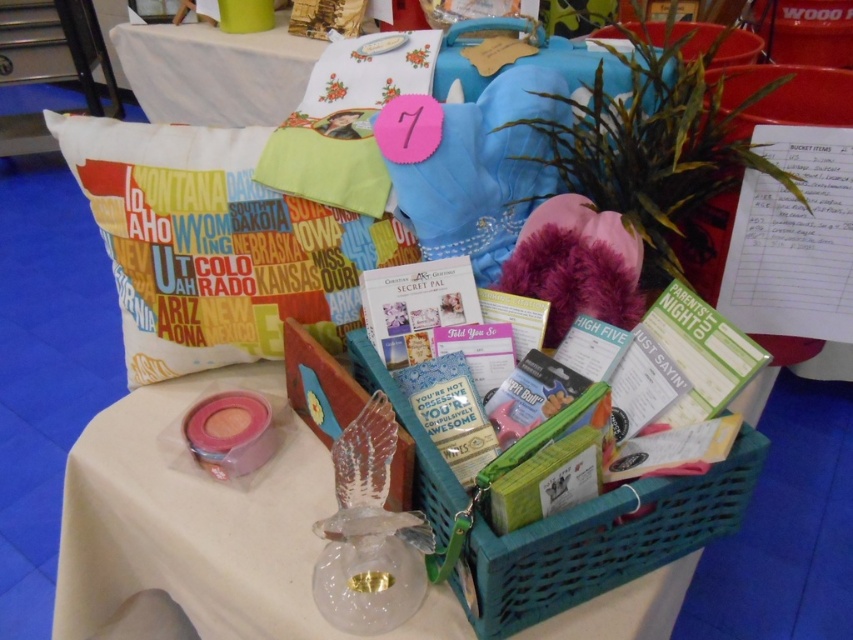
Question: Is the position of white fabric pillow at upper left less distant than that of white fabric tablecloth at upper center?

Choices:
 (A) no
 (B) yes

Answer: (B)

Question: Does white fabric pillow at upper left have a larger size compared to white fabric tablecloth at upper center?

Choices:
 (A) no
 (B) yes

Answer: (A)

Question: Which point is farther from the camera taking this photo?

Choices:
 (A) (196, 305)
 (B) (556, 538)
 (C) (283, 118)
 (D) (270, 380)

Answer: (C)

Question: Does white fabric pillow at upper left appear on the left side of teal plastic basket at center?

Choices:
 (A) no
 (B) yes

Answer: (B)

Question: Which object appears farthest from the camera in this image?

Choices:
 (A) teal plastic basket at center
 (B) white fabric pillow at upper left
 (C) white fabric tablecloth at upper center

Answer: (C)

Question: Which point appears closest to the camera in this image?

Choices:
 (A) (314, 44)
 (B) (485, 584)

Answer: (B)